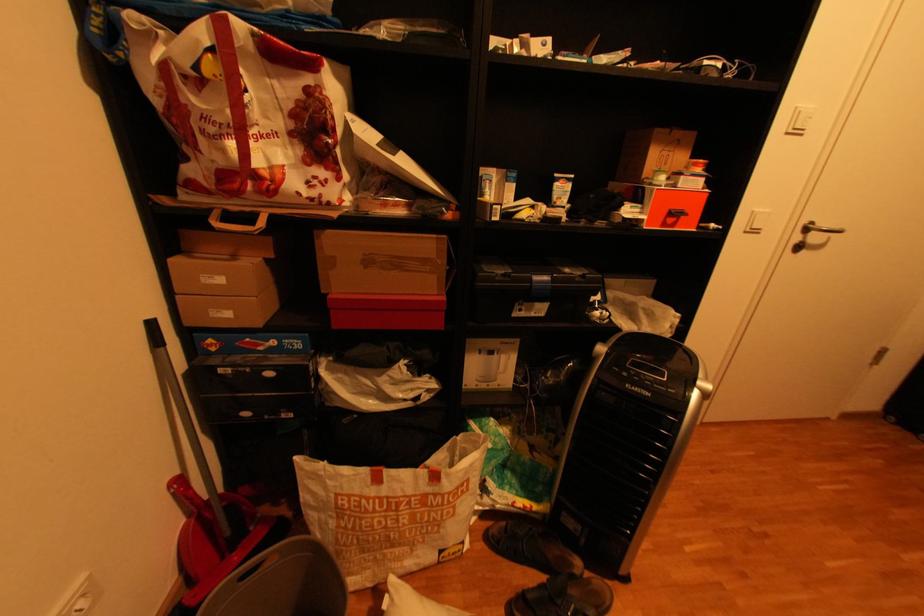
What do you see at coordinates (819, 230) in the screenshot? The width and height of the screenshot is (924, 616). I see `the silver door handle` at bounding box center [819, 230].